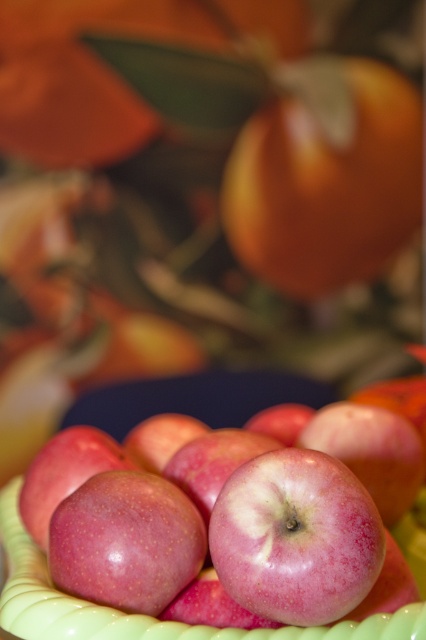
Does glossy red apple at center have a lesser width compared to orange matte tangerine at upper right?

Indeed, glossy red apple at center has a lesser width compared to orange matte tangerine at upper right.

Is glossy red apple at center below orange matte tangerine at upper right?

Yes.

Which is in front, point (213, 618) or point (408, 182)?

Point (213, 618) is in front.

Locate an element on the screen. The height and width of the screenshot is (640, 426). glossy red apple at center is located at coordinates (226, 515).

Who is shorter, glossy red apple at center or pink glossy apple at center?

Standing shorter between the two is pink glossy apple at center.

Who is higher up, glossy red apple at center or pink glossy apple at center?

glossy red apple at center is higher up.

You are a GUI agent. You are given a task and a screenshot of the screen. Output one action in this format:
    pyautogui.click(x=<x>, y=<y>)
    Task: Click on the glossy red apple at center
    This screenshot has width=426, height=640.
    Given the screenshot: What is the action you would take?
    pyautogui.click(x=226, y=515)

Is point (389, 90) farther from viewer compared to point (325, 624)?

Yes, it is behind point (325, 624).

Is orange matte tangerine at upper right smaller than pink glossy apple at center?

No, orange matte tangerine at upper right is not smaller than pink glossy apple at center.

Is point (327, 244) behind point (245, 528)?

That is True.

Locate an element on the screen. Image resolution: width=426 pixels, height=640 pixels. orange matte tangerine at upper right is located at coordinates (325, 176).